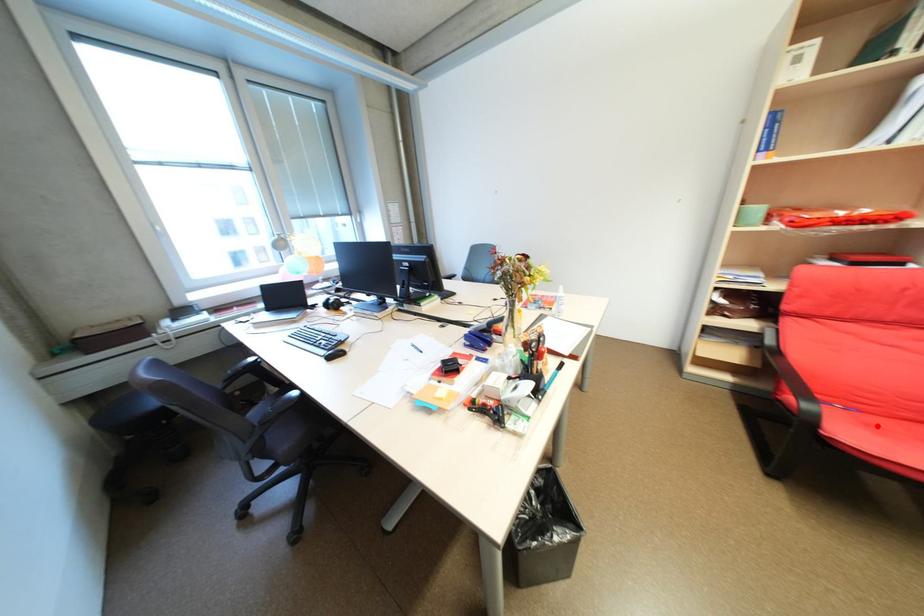
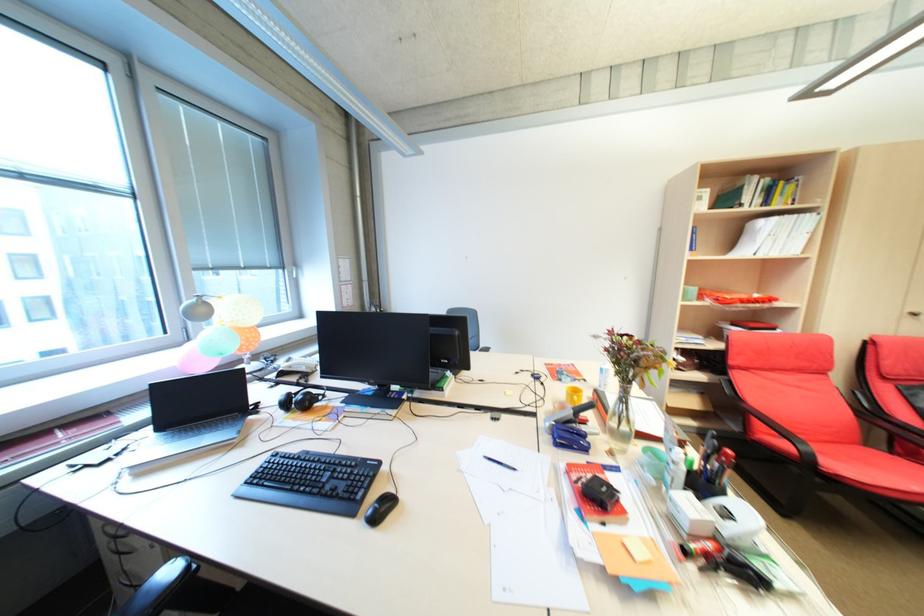
Find the pixel in the second image that matches the highlighted location in the first image.

(831, 454)